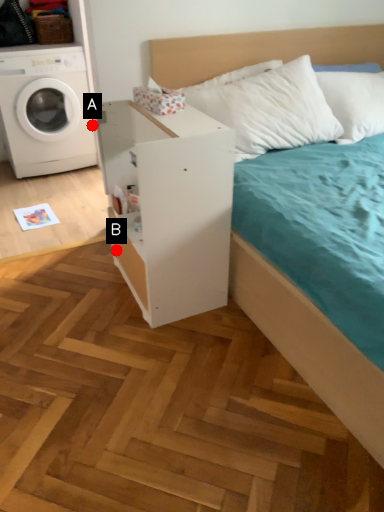
Question: Two points are circled on the image, labeled by A and B beside each circle. Which point is farther from the camera taking this photo?

Choices:
 (A) A is further
 (B) B is further

Answer: (A)